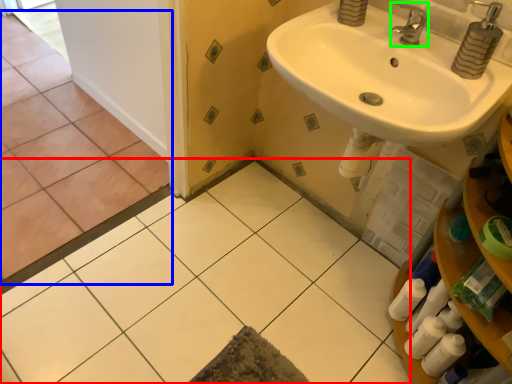
Question: Which object is positioned farthest from ceramic tile (highlighted by a red box)? Select from ceramic tile (highlighted by a blue box) and tap (highlighted by a green box).

Choices:
 (A) ceramic tile
 (B) tap

Answer: (B)